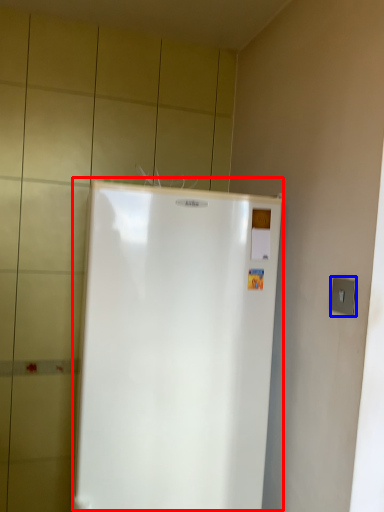
Question: Which point is further to the camera, refrigerator (highlighted by a red box) or electric outlet (highlighted by a blue box)?

Choices:
 (A) refrigerator
 (B) electric outlet

Answer: (A)